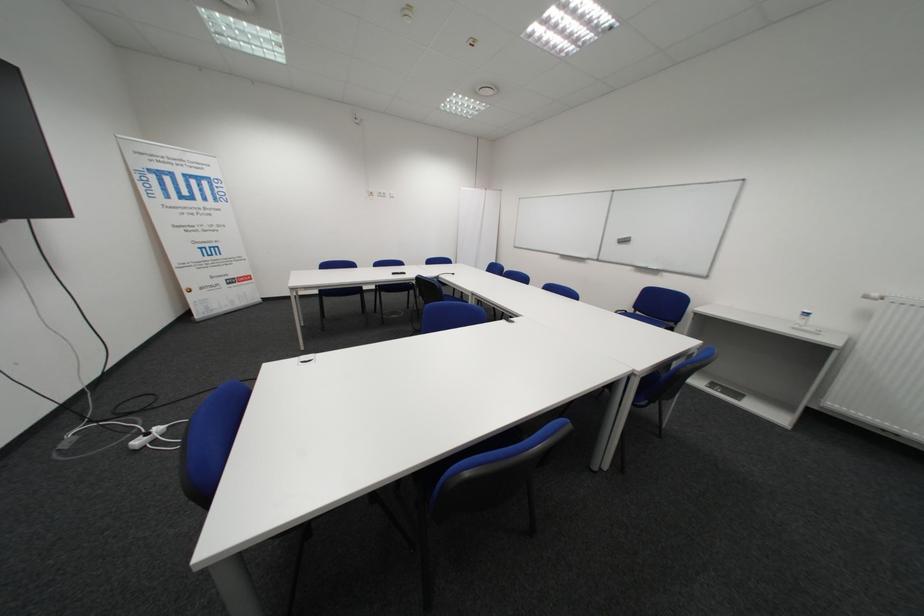
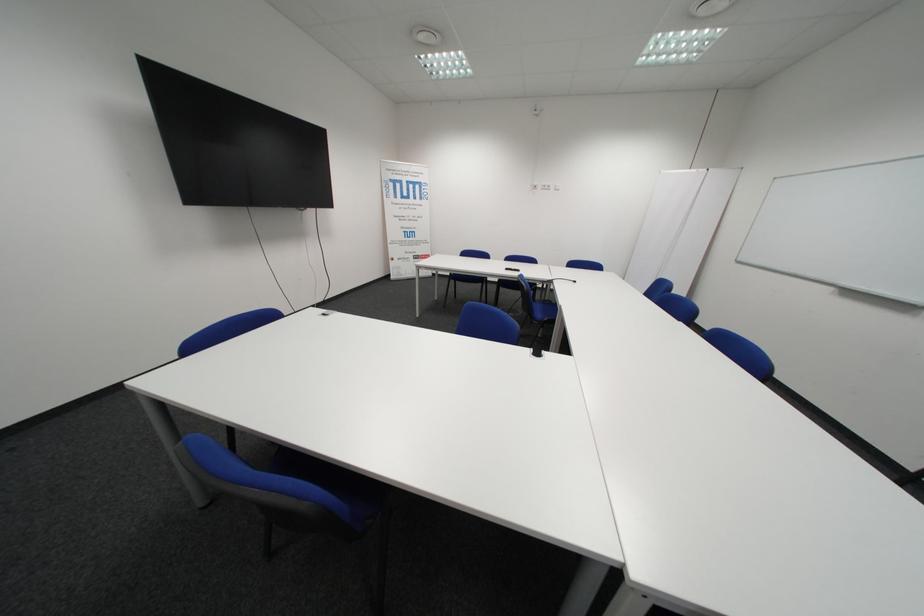
The point at (391, 196) is marked in the first image. Where is the corresponding point in the second image?

(554, 188)